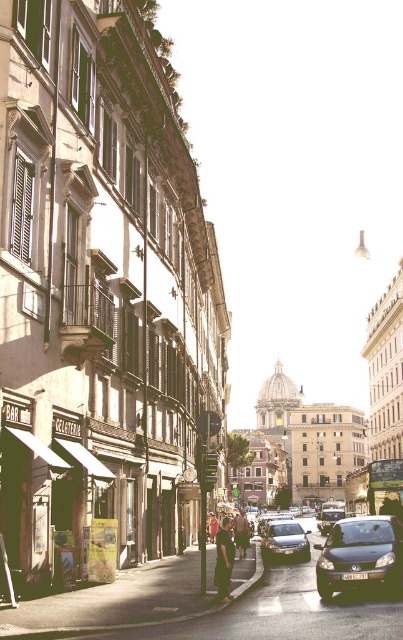
Question: Among these points, which one is nearest to the camera?

Choices:
 (A) (359, 548)
 (B) (236, 529)
 (C) (340, 515)
 (D) (214, 540)

Answer: (A)

Question: Which point is farther from the camera taking this photo?

Choices:
 (A) (228, 596)
 (B) (332, 513)

Answer: (B)

Question: Can you confirm if matte black car at lower right is positioned above light brown leather jacket at center?

Choices:
 (A) yes
 (B) no

Answer: (A)

Question: Can you confirm if black fabric person at center is thinner than shiny silver car at center?

Choices:
 (A) yes
 (B) no

Answer: (A)

Question: Which point is farther to the camera?

Choices:
 (A) (338, 518)
 (B) (376, 552)
 (C) (207, 525)
 (D) (240, 529)

Answer: (A)

Question: From the image, what is the correct spatial relationship of dark blue jeans at center in relation to light brown leather jacket at center?

Choices:
 (A) below
 (B) above

Answer: (B)